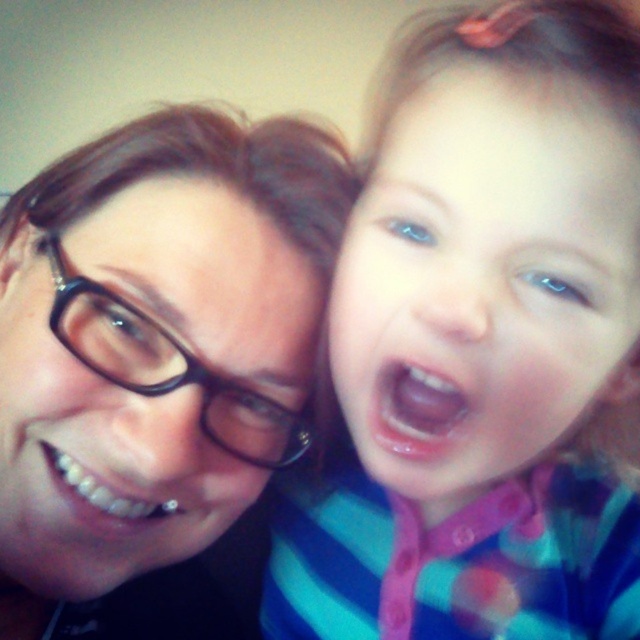
Question: Among these objects, which one is farthest from the camera?

Choices:
 (A) matte black glasses at left
 (B) blue eyes at center

Answer: (A)

Question: Which of the following is the farthest from the observer?

Choices:
 (A) (205, 250)
 (B) (436, 480)

Answer: (A)

Question: Does blue eyes at center appear under matte black glasses at left?

Choices:
 (A) yes
 (B) no

Answer: (A)

Question: Does blue eyes at center have a lesser width compared to matte black glasses at left?

Choices:
 (A) yes
 (B) no

Answer: (A)

Question: Is blue eyes at center above matte black glasses at left?

Choices:
 (A) yes
 (B) no

Answer: (B)